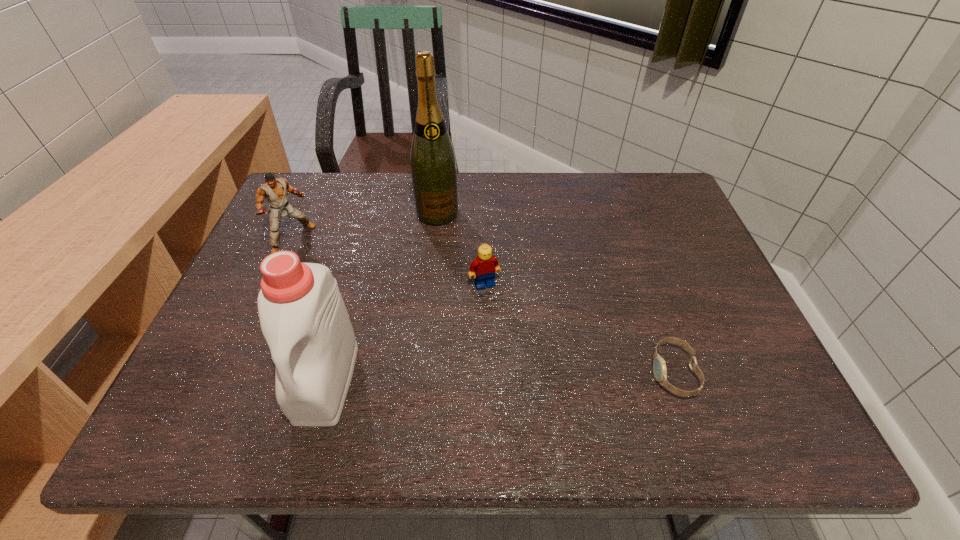
Find the location of a particular element. vacant region located 0.170m on the front-facing side of the fourth object from left to right is located at coordinates (515, 346).

Where is `blank space located on the front-facing side of the fourth object from left to right`? This screenshot has width=960, height=540. blank space located on the front-facing side of the fourth object from left to right is located at coordinates (525, 369).

You are a GUI agent. You are given a task and a screenshot of the screen. Output one action in this format:
    pyautogui.click(x=<x>, y=<y>)
    Task: Click on the object that is at the far edge
    
    Given the screenshot: What is the action you would take?
    pyautogui.click(x=432, y=160)

Where is `detergent at the near edge`? detergent at the near edge is located at coordinates (303, 317).

At what (x,y) coordinates should I click in order to perform the action: click on watch located in the near edge section of the desktop. Please return your answer as a coordinate pair (x, y). Looking at the image, I should click on (659, 365).

In order to click on object present at the left edge in this screenshot , I will do `click(275, 191)`.

Image resolution: width=960 pixels, height=540 pixels. What are the coordinates of `object that is at the right edge` in the screenshot? It's located at (659, 365).

Find the location of `object at the near right corner`. object at the near right corner is located at coordinates (659, 365).

Where is `vacant region at the far edge of the desktop`? The height and width of the screenshot is (540, 960). vacant region at the far edge of the desktop is located at coordinates (591, 200).

Locate an element on the screen. free space at the near edge of the desktop is located at coordinates (534, 369).